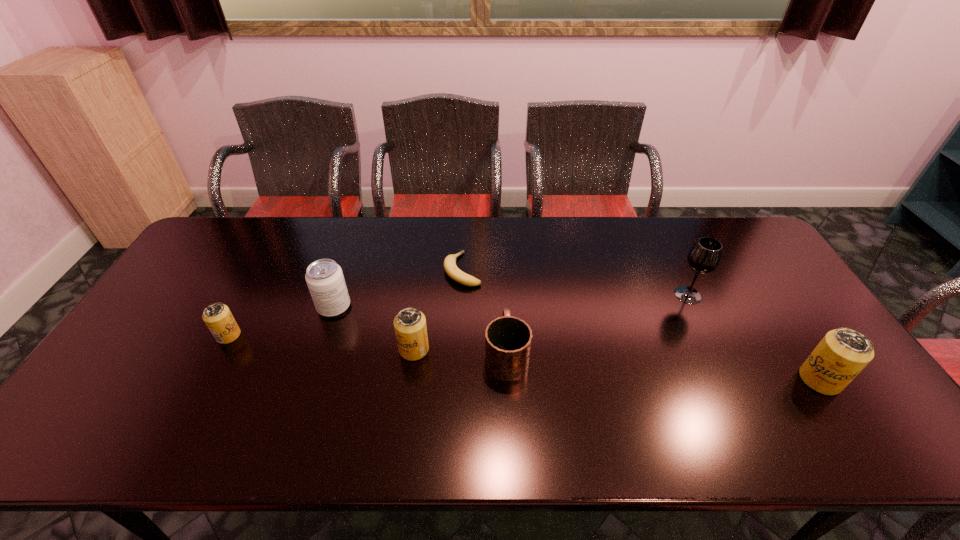
Where is `the shortest beer can`? the shortest beer can is located at coordinates (217, 316).

Locate an element on the screen. Image resolution: width=960 pixels, height=540 pixels. the leftmost object is located at coordinates (217, 316).

Locate an element on the screen. the fifth object from right to left is located at coordinates (410, 327).

I want to click on the second beer can from right to left, so click(x=410, y=327).

Find the location of a particular element. the tallest beer can is located at coordinates (843, 353).

You are a GUI agent. You are given a task and a screenshot of the screen. Output one action in this format:
    pyautogui.click(x=<x>, y=<y>)
    Task: Click on the rightmost beer can
    The image size is (960, 540).
    Given the screenshot: What is the action you would take?
    843,353

The image size is (960, 540). I want to click on the tallest object, so click(704, 257).

Find the location of a particular element. The height and width of the screenshot is (540, 960). the sixth object from left to right is located at coordinates (704, 257).

Locate an element on the screen. soda can is located at coordinates (324, 277).

Find the location of `the shortest object`. the shortest object is located at coordinates (452, 270).